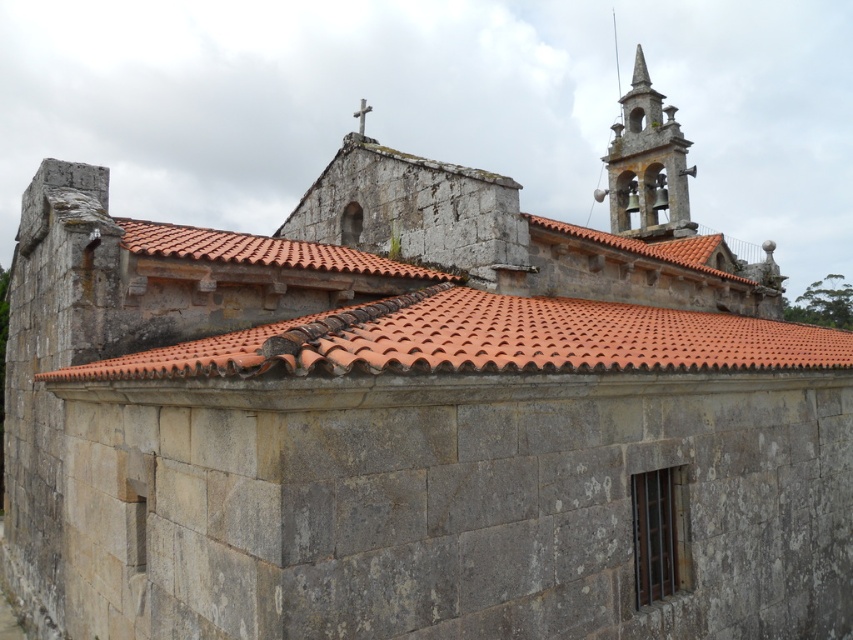
Question: Which point is farther to the camera?

Choices:
 (A) stone bell tower at upper right
 (B) orange clay tiles at center

Answer: (A)

Question: Can you confirm if orange clay tiles at center is smaller than stone bell tower at upper right?

Choices:
 (A) yes
 (B) no

Answer: (B)

Question: Is orange clay tiles at center thinner than stone bell tower at upper right?

Choices:
 (A) yes
 (B) no

Answer: (B)

Question: Can you confirm if orange clay tiles at center is bigger than stone bell tower at upper right?

Choices:
 (A) yes
 (B) no

Answer: (A)